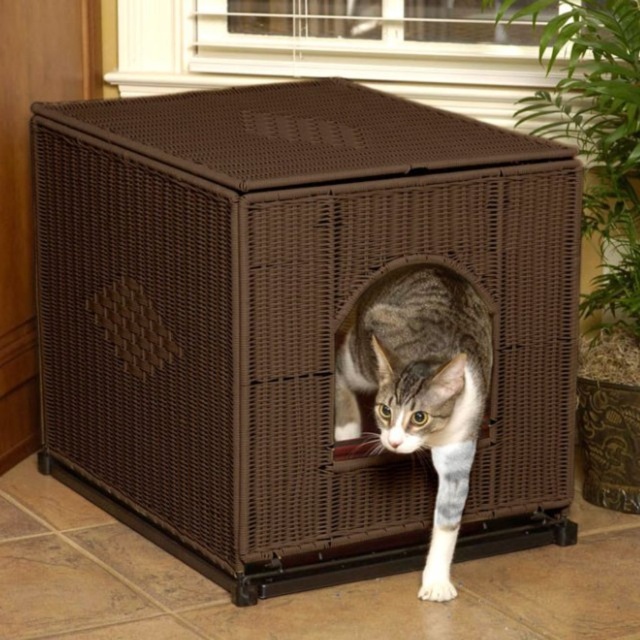
From the picture: Between brown wicker crate at center and tabby fur cat at center, which one appears on the left side from the viewer's perspective?

Positioned to the left is brown wicker crate at center.

Which is in front, point (388, 550) or point (461, 312)?

Point (461, 312) is in front.

Where is `brown wicker crate at center`? brown wicker crate at center is located at coordinates (291, 320).